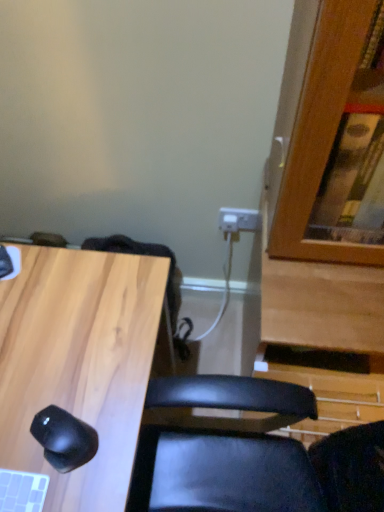
Find the location of a particular element. free area behind black matte mouse at lower left is located at coordinates (76, 355).